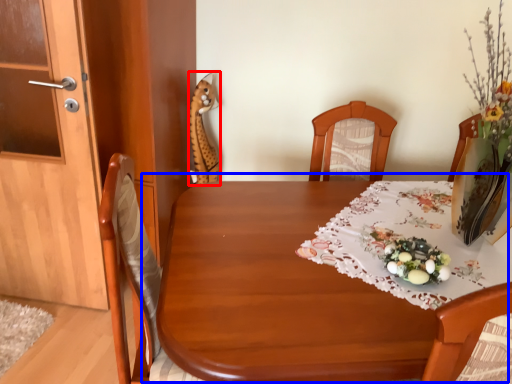
Question: Among these objects, which one is nearest to the camera, animal (highlighted by a red box) or table (highlighted by a blue box)?

Choices:
 (A) animal
 (B) table

Answer: (B)